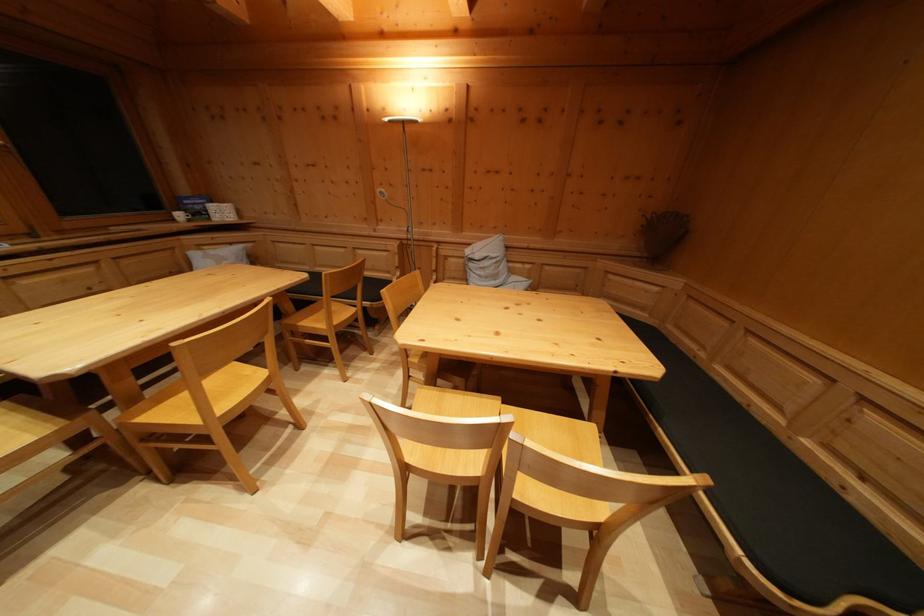
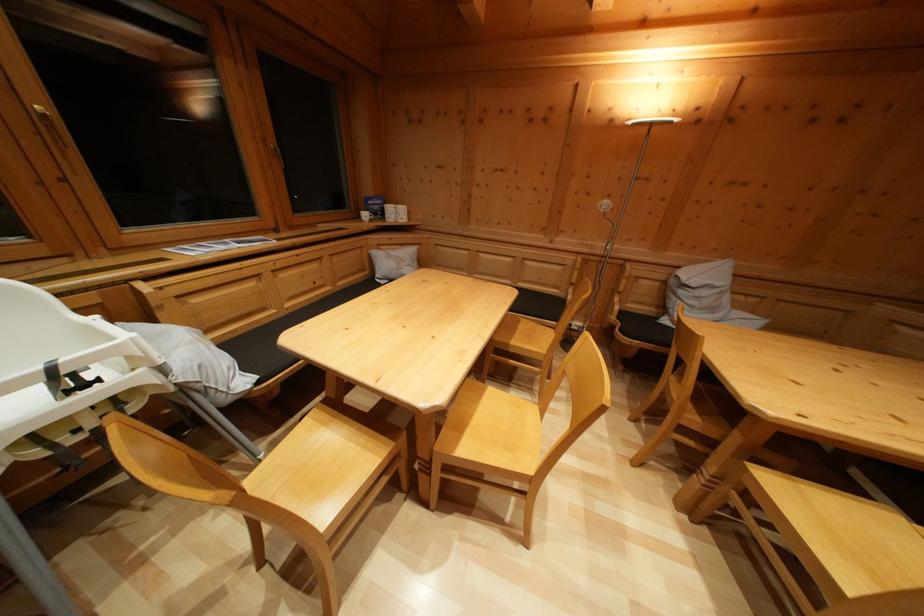
In the second image, find the point that corresponds to (x=71, y=430) in the first image.

(398, 451)